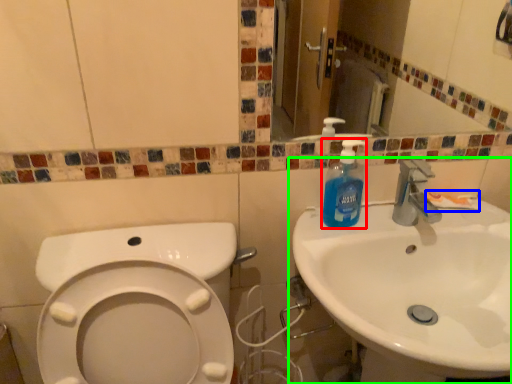
Question: Estimate the real-world distances between objects in this image. Which object is closer to cleaning product (highlighted by a red box), toothpaste (highlighted by a blue box) or sink (highlighted by a green box)?

Choices:
 (A) toothpaste
 (B) sink

Answer: (B)